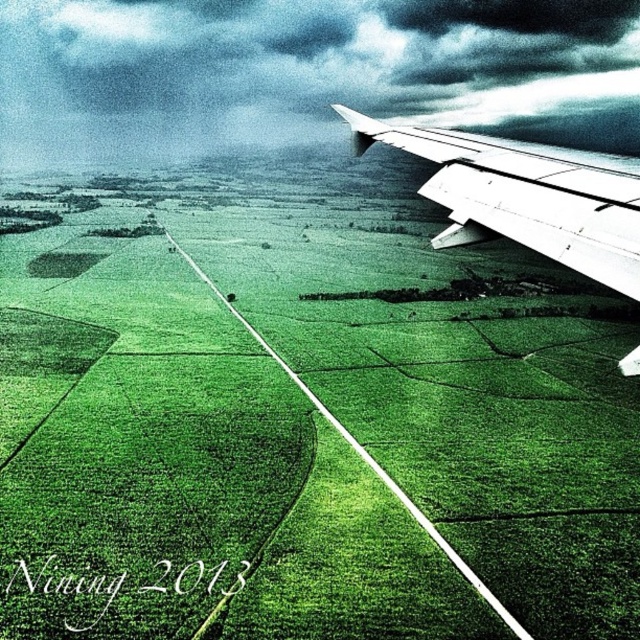
Question: Considering the relative positions of dark gray textured cloud at upper center and white matte wing at upper right in the image provided, where is dark gray textured cloud at upper center located with respect to white matte wing at upper right?

Choices:
 (A) left
 (B) right

Answer: (A)

Question: Is green grassy field at upper center to the left of dark gray textured cloud at upper center from the viewer's perspective?

Choices:
 (A) yes
 (B) no

Answer: (B)

Question: Which of these objects is positioned closest to the dark gray textured cloud at upper center?

Choices:
 (A) green grassy field at upper center
 (B) white matte wing at upper right

Answer: (A)

Question: Among these objects, which one is nearest to the camera?

Choices:
 (A) green grassy field at upper center
 (B) dark gray textured cloud at upper center
 (C) white matte wing at upper right

Answer: (C)

Question: Which point is closer to the camera?

Choices:
 (A) (321, 362)
 (B) (582, 180)

Answer: (B)

Question: Can you confirm if dark gray textured cloud at upper center is positioned to the right of white matte wing at upper right?

Choices:
 (A) no
 (B) yes

Answer: (A)